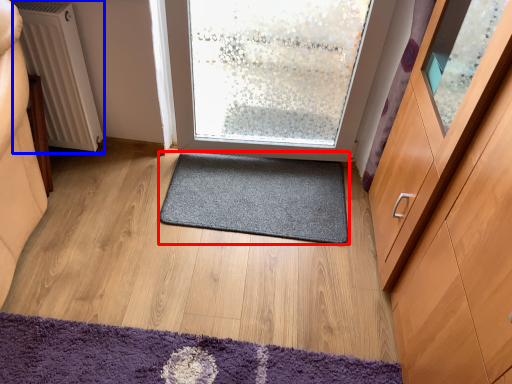
Question: Which point is further to the camera, mat (highlighted by a red box) or radiator (highlighted by a blue box)?

Choices:
 (A) mat
 (B) radiator

Answer: (A)